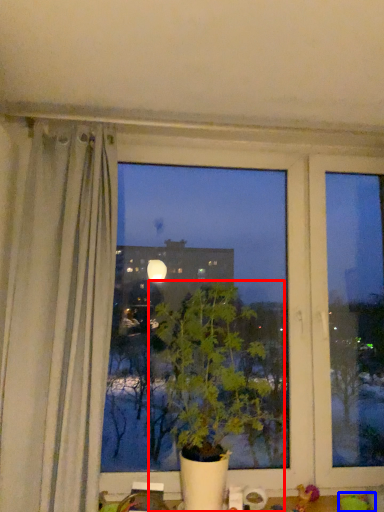
Question: Which point is closer to the camera, houseplant (highlighted by a red box) or toy (highlighted by a blue box)?

Choices:
 (A) houseplant
 (B) toy

Answer: (A)